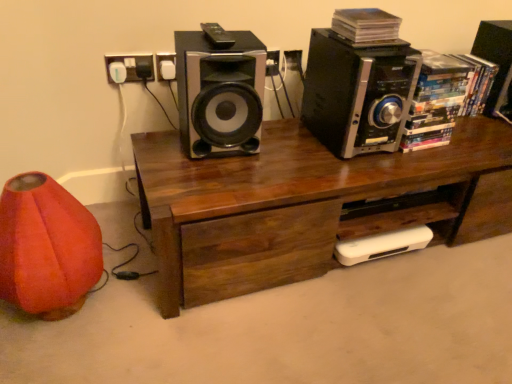
The height and width of the screenshot is (384, 512). I want to click on free space to the left of metallic silver speaker at center, which ranks as the 3th speaker in right-to-left order, so click(159, 146).